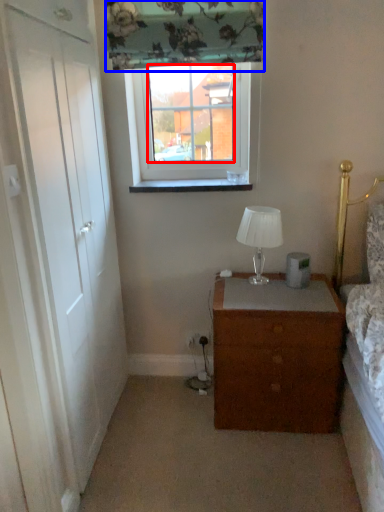
Question: Which point is further to the camera, window screen (highlighted by a red box) or curtain (highlighted by a blue box)?

Choices:
 (A) window screen
 (B) curtain

Answer: (A)